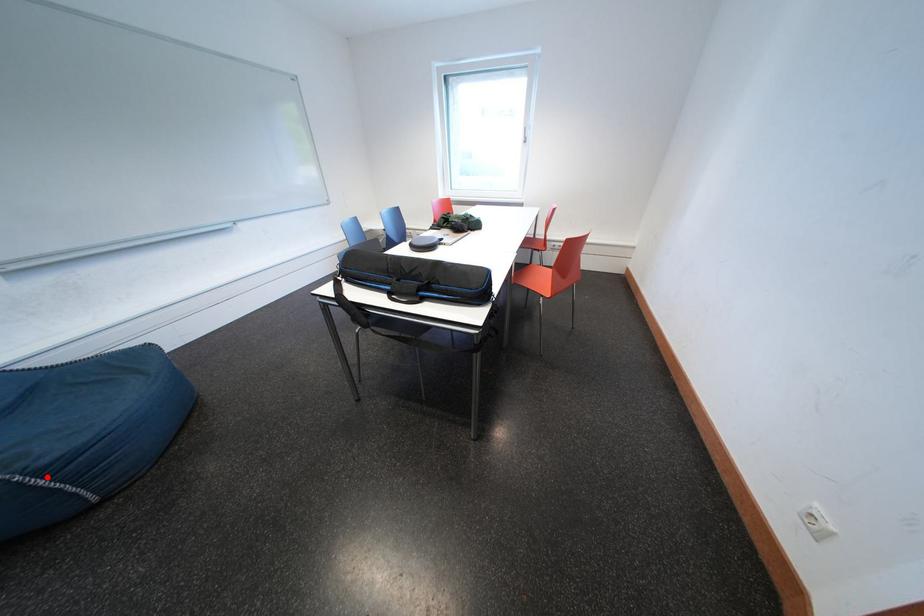
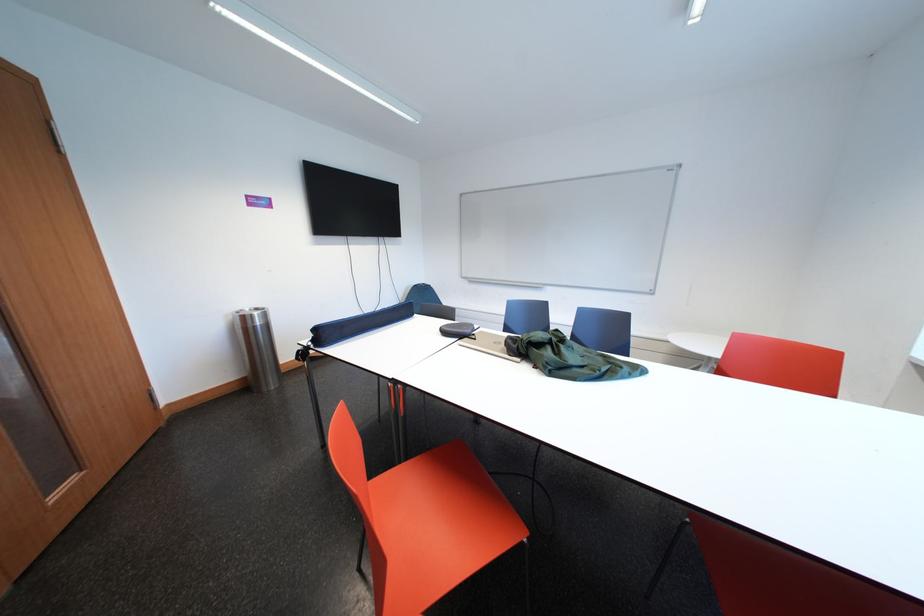
Question: I am providing you with two images of the same scene from different viewpoints. A red point is marked on the first image. At the location where the point appears in image 1, is it still visible in image 2?

Choices:
 (A) Yes
 (B) No

Answer: (B)